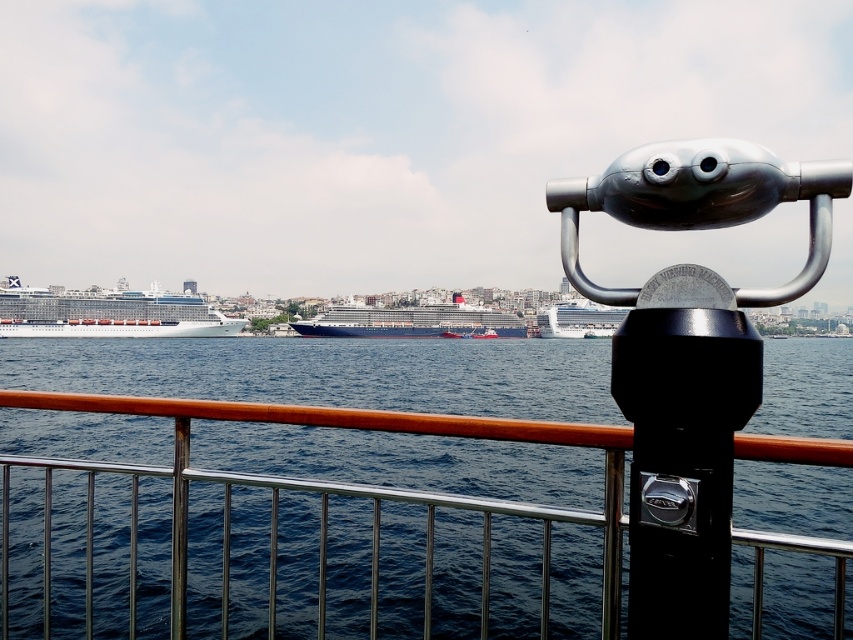
You are standing at the viewing platform and want to look at the dark blue water at center and the blue metallic cruise ship at center through the binoculars. Which object will appear to your left when looking through the binoculars?

The blue metallic cruise ship at center is positioned to the left of the dark blue water at center, so when looking through the binoculars, the blue metallic cruise ship at center will be on your left side.

You are standing on the viewing platform and want to use the binoculars to look at the blue metallic cruise ship at left. Since the dark blue water at center is in your way, will you need to adjust the binoculars to focus on the ship?

The dark blue water at center is closer to the viewer than the blue metallic cruise ship at left, so you will need to adjust the binoculars to focus on the ship beyond the water.

You are standing at the viewing platform and want to use the coin operated binocular viewer to observe the cruise ships. Which cruise ship, the blue metallic cruise ship at left or the blue metallic cruise ship at center, would appear wider through the binoculars?

The blue metallic cruise ship at center would appear wider through the binoculars as it has a greater width compared to the blue metallic cruise ship at left.